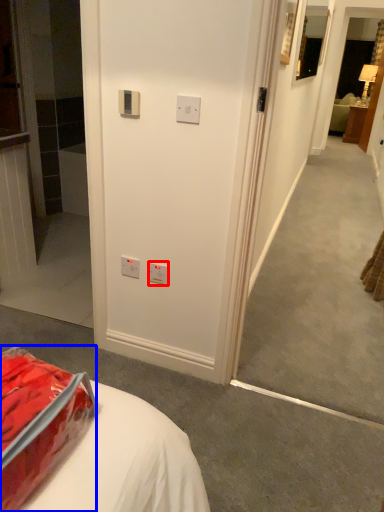
Question: Among these objects, which one is nearest to the camera, electric outlet (highlighted by a red box) or package (highlighted by a blue box)?

Choices:
 (A) electric outlet
 (B) package

Answer: (B)